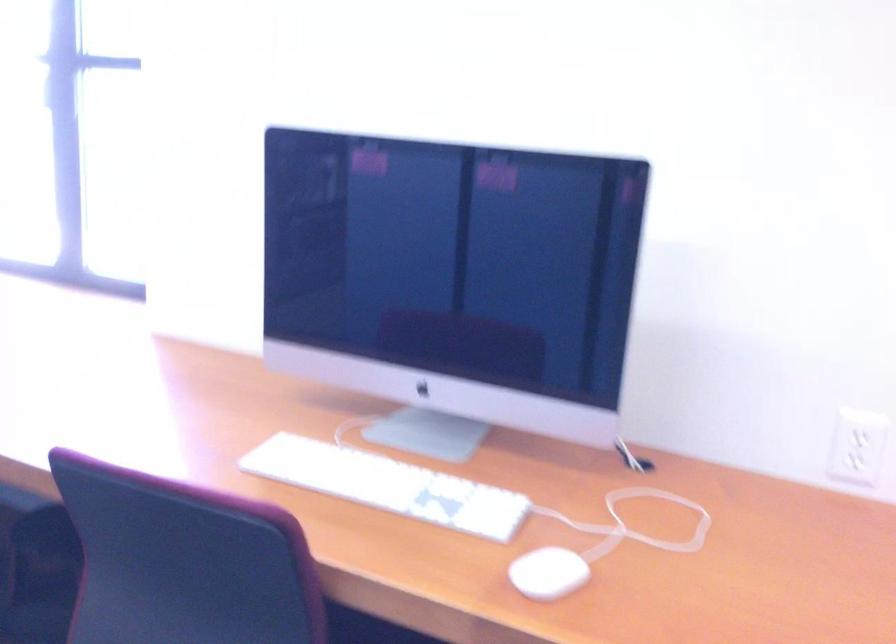
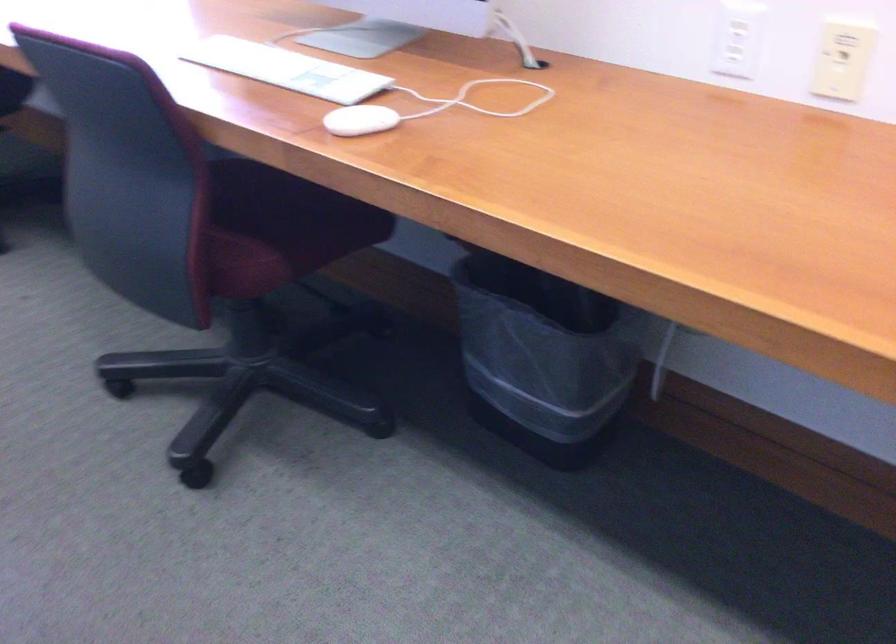
Locate, in the second image, the point that corresponds to (385,486) in the first image.

(286, 69)